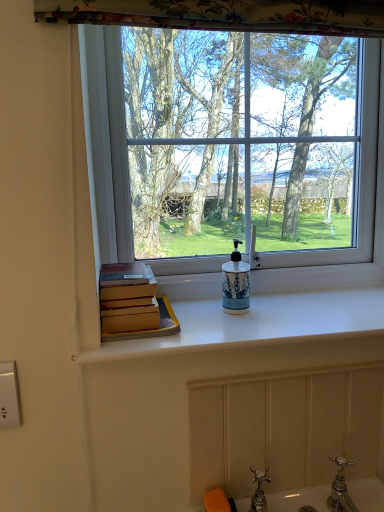
Where is `free location to the right of blue and white ceramic soap dispenser at center`? free location to the right of blue and white ceramic soap dispenser at center is located at coordinates (296, 313).